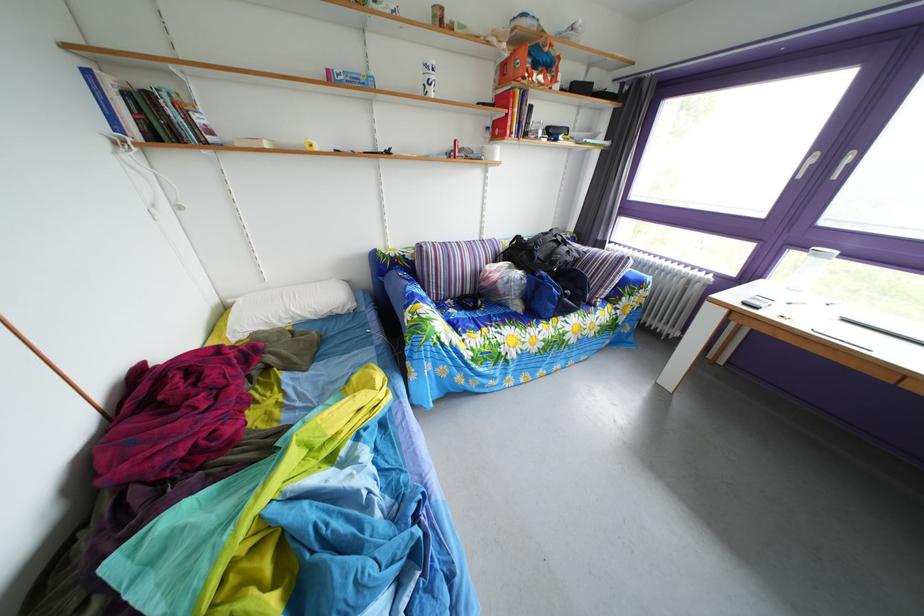
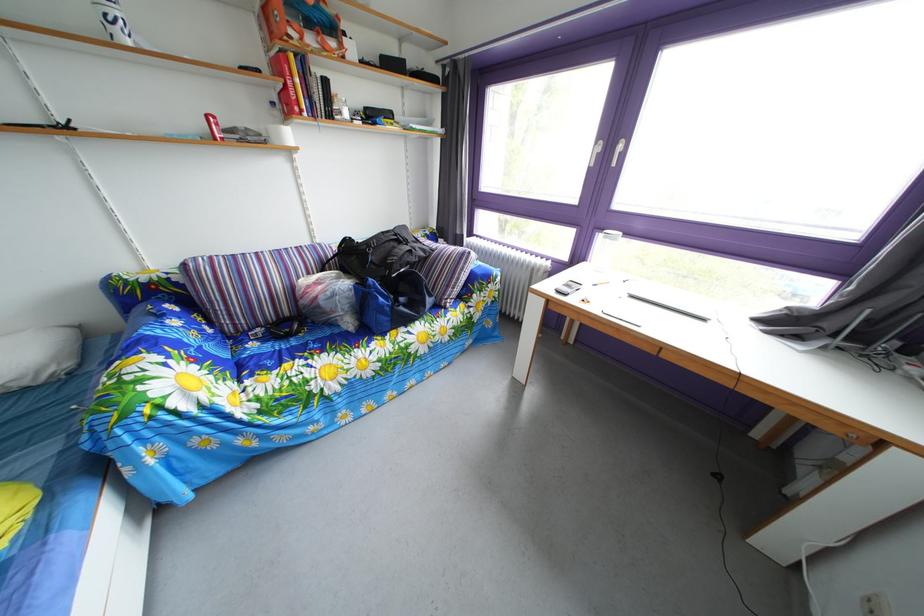
The point at (463,320) is marked in the first image. Where is the corresponding point in the second image?

(262, 353)